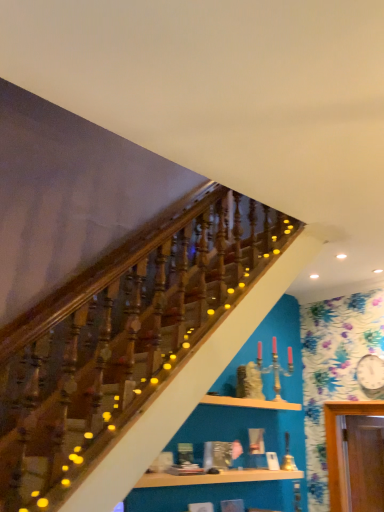
Question: Is point (266, 399) closer or farther from the camera than point (168, 479)?

Choices:
 (A) closer
 (B) farther

Answer: (B)

Question: Based on their positions, is wooden shelf at center, acting as the 2th shelf starting from the bottom, located to the left or right of wooden shelf at lower center, acting as the 1th shelf starting from the bottom?

Choices:
 (A) right
 (B) left

Answer: (A)

Question: From a real-world perspective, is wooden shelf at center, acting as the 2th shelf starting from the bottom, above or below wooden shelf at lower center, which is the second shelf in top-to-bottom order?

Choices:
 (A) above
 (B) below

Answer: (A)

Question: Is wooden shelf at lower center, acting as the 1th shelf starting from the bottom, inside the boundaries of wooden shelf at center, which ranks as the 1th shelf in top-to-bottom order, or outside?

Choices:
 (A) inside
 (B) outside

Answer: (B)

Question: In terms of width, does wooden shelf at lower center, which is the second shelf in top-to-bottom order, look wider or thinner when compared to wooden shelf at center, which ranks as the 1th shelf in top-to-bottom order?

Choices:
 (A) thin
 (B) wide

Answer: (A)

Question: Relative to wooden shelf at center, which ranks as the 1th shelf in top-to-bottom order, is wooden shelf at lower center, acting as the 1th shelf starting from the bottom, in front or behind?

Choices:
 (A) front
 (B) behind

Answer: (A)

Question: Considering the positions of point (188, 481) and point (233, 397), is point (188, 481) closer or farther from the camera than point (233, 397)?

Choices:
 (A) closer
 (B) farther

Answer: (A)